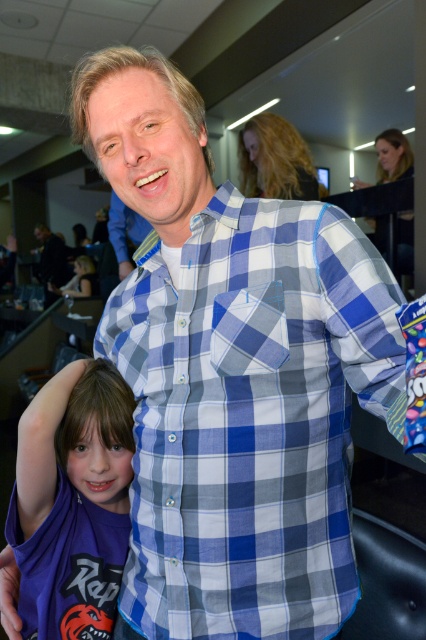
Which is more to the right, blue plaid shirt at center or purple matte shirt at lower left?

blue plaid shirt at center is more to the right.

Does point (302, 221) lie behind point (80, 465)?

No, (302, 221) is closer to viewer.

Which is in front, point (314, 282) or point (112, 477)?

Positioned in front is point (314, 282).

Where is `blue plaid shirt at center`? The height and width of the screenshot is (640, 426). blue plaid shirt at center is located at coordinates (250, 417).